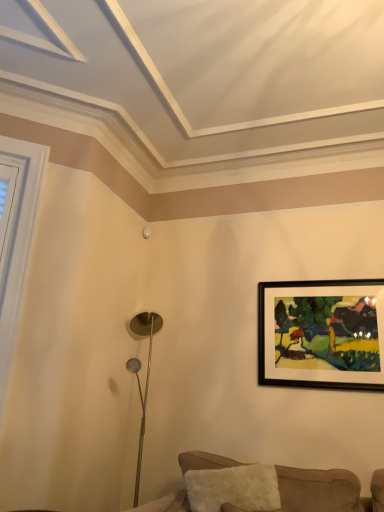
Describe the element at coordinates (321, 334) in the screenshot. I see `black matte picture frame at upper right` at that location.

Locate an element on the screen. black matte picture frame at upper right is located at coordinates (321, 334).

Where is `black matte picture frame at upper right`? black matte picture frame at upper right is located at coordinates (321, 334).